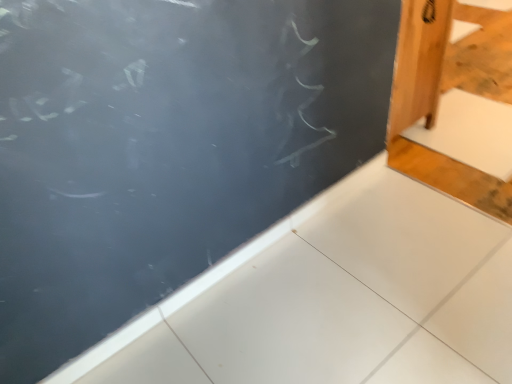
This screenshot has height=384, width=512. Describe the element at coordinates (446, 91) in the screenshot. I see `wooden chair at right` at that location.

I want to click on wooden chair at right, so click(x=446, y=91).

The image size is (512, 384). Identify the location of wooden chair at right. (446, 91).